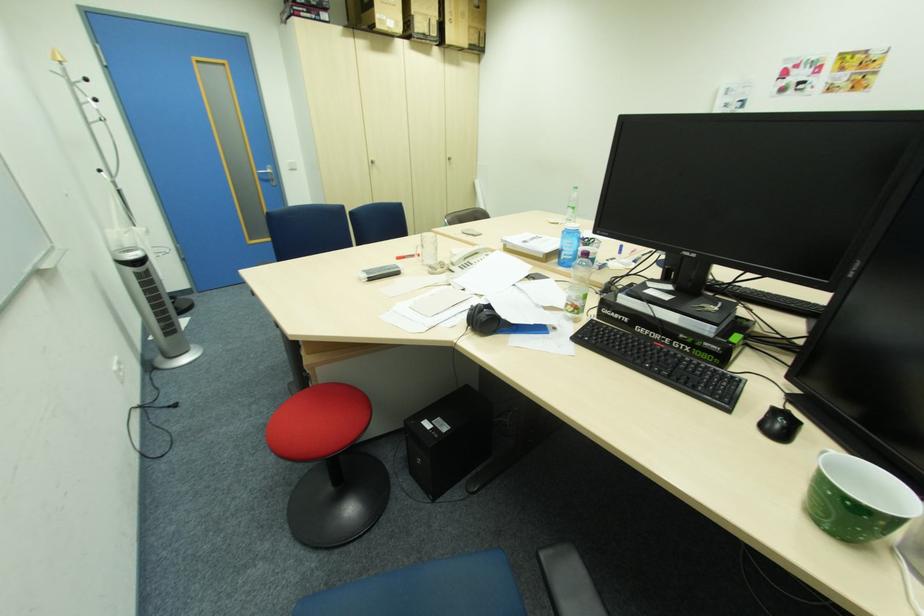
Identify the location of silver door handle. The image size is (924, 616). (268, 175).